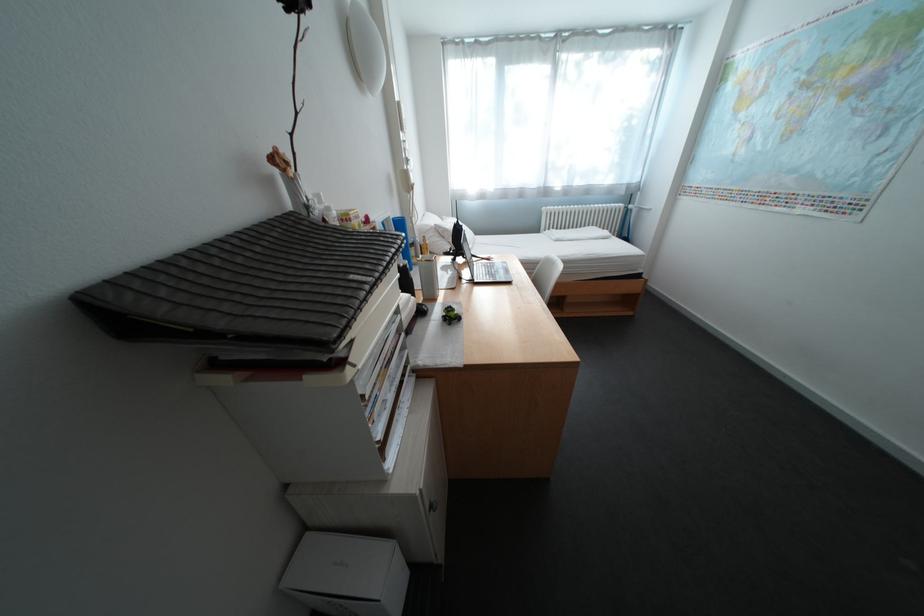
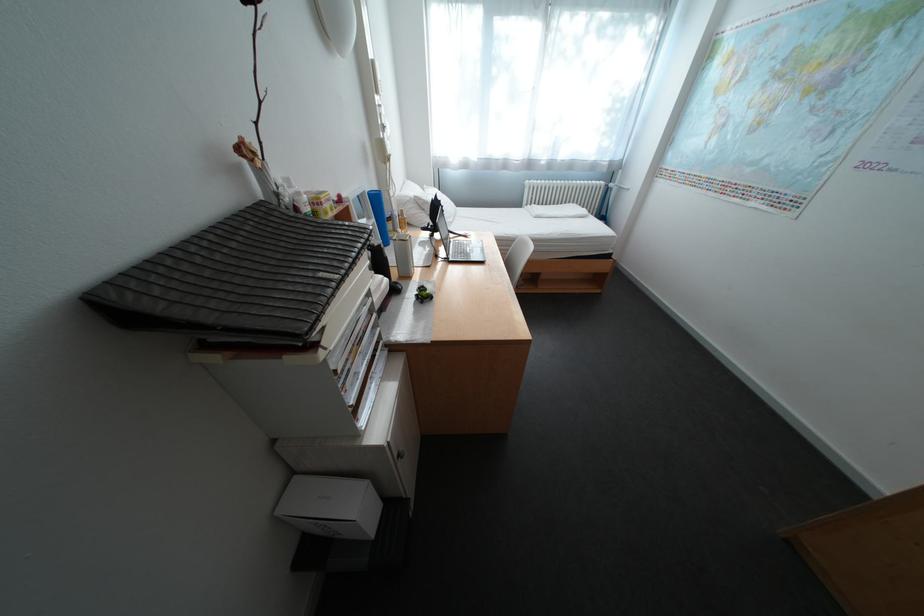
The point at (494, 259) is marked in the first image. Where is the corresponding point in the second image?

(472, 236)